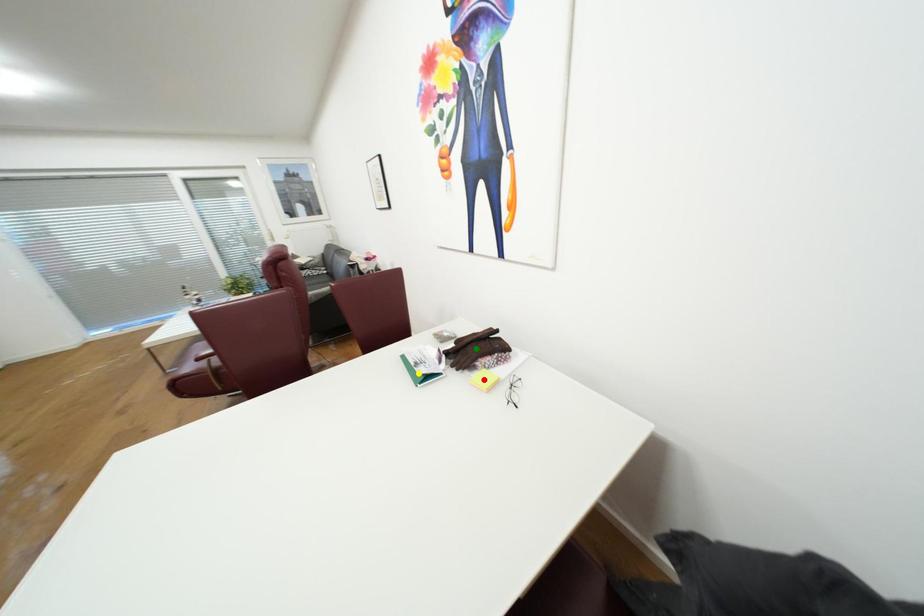
Order these from nearest to farthest:
green point, yellow point, red point

red point < yellow point < green point